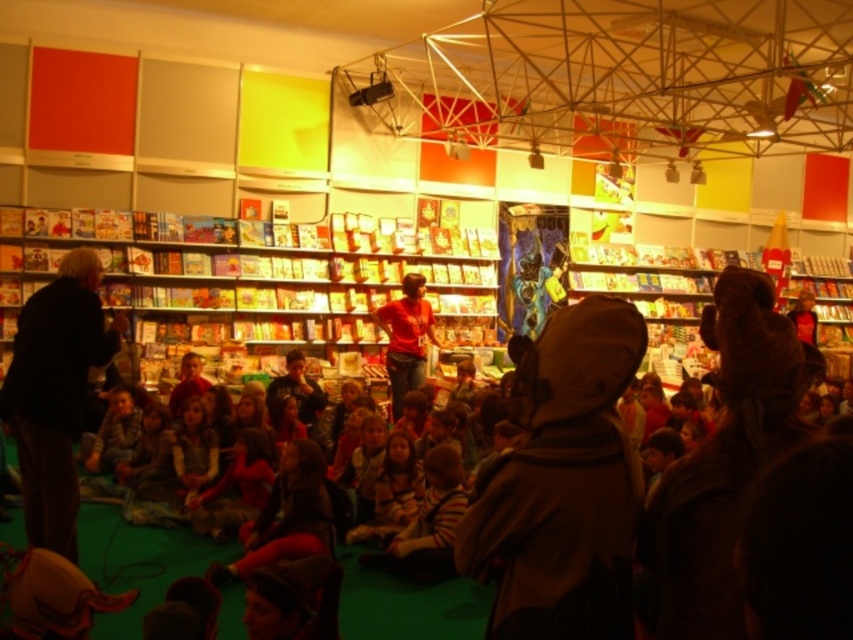
You are a photographer standing in the back of the room. You want to take a photo of both the dark brown jacket at left and the matte red shirt at center. Which object should you focus on first to ensure both are in focus?

The dark brown jacket at left is taller than the matte red shirt at center, so you should focus on the dark brown jacket at left first to ensure both are in focus.

You are standing in the bookstore and see the dark brown jacket at left. If you want to approach it, how many steps would you need to take to reach it?

The dark brown jacket at left is 4.11 meters away from you. Assuming an average step length of about 0.76 meters, you would need approximately 5.4 steps to reach it. Since you can only take whole steps, you would need to take 6 steps to reach the dark brown jacket at left.